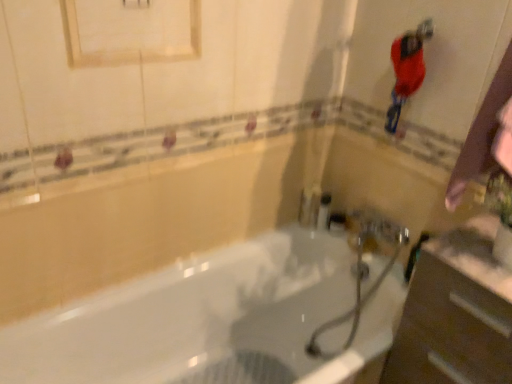
Question: Can you confirm if shiny red hairbrush at upper right is smaller than metallic silver faucet at center?

Choices:
 (A) yes
 (B) no

Answer: (B)

Question: Is shiny red hairbrush at upper right facing towards metallic silver faucet at center?

Choices:
 (A) yes
 (B) no

Answer: (B)

Question: Does shiny red hairbrush at upper right come behind metallic silver faucet at center?

Choices:
 (A) yes
 (B) no

Answer: (B)

Question: From the image's perspective, is shiny red hairbrush at upper right on top of metallic silver faucet at center?

Choices:
 (A) no
 (B) yes

Answer: (B)

Question: From a real-world perspective, is shiny red hairbrush at upper right beneath metallic silver faucet at center?

Choices:
 (A) yes
 (B) no

Answer: (B)

Question: Is shiny red hairbrush at upper right wider than metallic silver faucet at center?

Choices:
 (A) no
 (B) yes

Answer: (B)

Question: Is shiny red hairbrush at upper right facing towards white matte medicine cabinet at upper center?

Choices:
 (A) no
 (B) yes

Answer: (A)

Question: From the image's perspective, is shiny red hairbrush at upper right on white matte medicine cabinet at upper center?

Choices:
 (A) yes
 (B) no

Answer: (B)

Question: Is shiny red hairbrush at upper right not within white matte medicine cabinet at upper center?

Choices:
 (A) yes
 (B) no

Answer: (A)

Question: Would you say shiny red hairbrush at upper right is a long distance from white matte medicine cabinet at upper center?

Choices:
 (A) yes
 (B) no

Answer: (B)

Question: Can you confirm if shiny red hairbrush at upper right is bigger than white matte medicine cabinet at upper center?

Choices:
 (A) yes
 (B) no

Answer: (B)

Question: From a real-world perspective, is shiny red hairbrush at upper right physically below white matte medicine cabinet at upper center?

Choices:
 (A) no
 (B) yes

Answer: (B)

Question: Is white glossy bathtub at center positioned far away from metallic silver faucet at center?

Choices:
 (A) no
 (B) yes

Answer: (A)